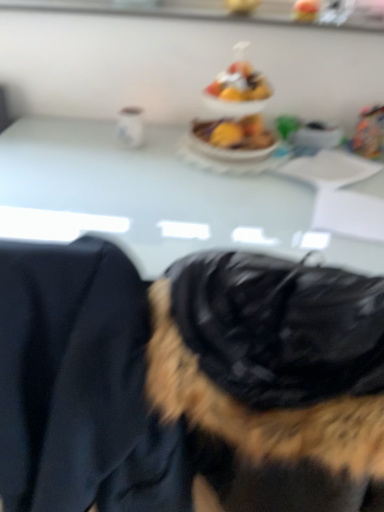
Question: Considering the relative sizes of shiny plastic fruit bowl at center and white glossy table at center in the image provided, is shiny plastic fruit bowl at center smaller than white glossy table at center?

Choices:
 (A) no
 (B) yes

Answer: (B)

Question: Is shiny plastic fruit bowl at center not inside white glossy table at center?

Choices:
 (A) yes
 (B) no

Answer: (A)

Question: Is shiny plastic fruit bowl at center positioned behind white glossy table at center?

Choices:
 (A) no
 (B) yes

Answer: (B)

Question: Is shiny plastic fruit bowl at center to the right of white glossy table at center from the viewer's perspective?

Choices:
 (A) no
 (B) yes

Answer: (B)

Question: Could white glossy table at center be considered to be inside shiny plastic fruit bowl at center?

Choices:
 (A) yes
 (B) no

Answer: (B)

Question: Does shiny plastic fruit bowl at center have a greater height compared to white glossy table at center?

Choices:
 (A) no
 (B) yes

Answer: (A)

Question: Is black fur coat at center behind white glossy table at center?

Choices:
 (A) no
 (B) yes

Answer: (A)

Question: Is black fur coat at center not within white glossy table at center?

Choices:
 (A) yes
 (B) no

Answer: (A)

Question: Is black fur coat at center in contact with white glossy table at center?

Choices:
 (A) no
 (B) yes

Answer: (A)

Question: From a real-world perspective, is black fur coat at center physically above white glossy table at center?

Choices:
 (A) yes
 (B) no

Answer: (A)

Question: Can you confirm if black fur coat at center is positioned to the right of white glossy table at center?

Choices:
 (A) yes
 (B) no

Answer: (A)

Question: From the image's perspective, is black fur coat at center located above white glossy table at center?

Choices:
 (A) yes
 (B) no

Answer: (B)

Question: Is white glossy table at center to the left of black fur coat at center from the viewer's perspective?

Choices:
 (A) no
 (B) yes

Answer: (B)